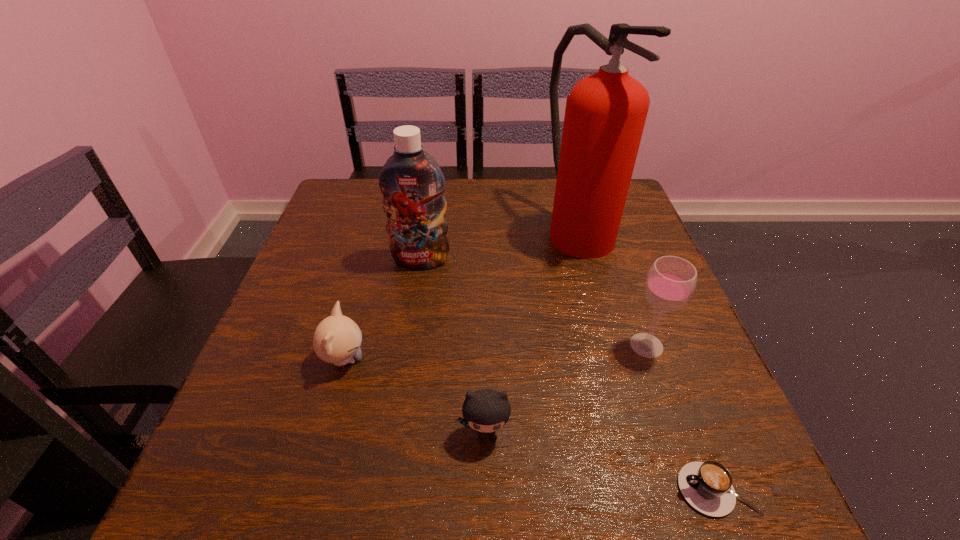
Where is `fire extinguisher`? This screenshot has width=960, height=540. fire extinguisher is located at coordinates (605, 114).

Locate an element on the screen. shampoo is located at coordinates (412, 183).

Locate an element on the screen. the fifth object from right to left is located at coordinates (412, 183).

Locate an element on the screen. This screenshot has width=960, height=540. the fourth shortest object is located at coordinates (671, 280).

The image size is (960, 540). I want to click on the left kitten, so click(337, 339).

The height and width of the screenshot is (540, 960). I want to click on the leftmost object, so click(337, 339).

The width and height of the screenshot is (960, 540). I want to click on the nearer kitten, so click(486, 410).

Where is `the third object from left to right`? the third object from left to right is located at coordinates (486, 410).

Identify the location of the nearest object. This screenshot has height=540, width=960. (707, 486).

The height and width of the screenshot is (540, 960). I want to click on the shortest object, so click(x=707, y=486).